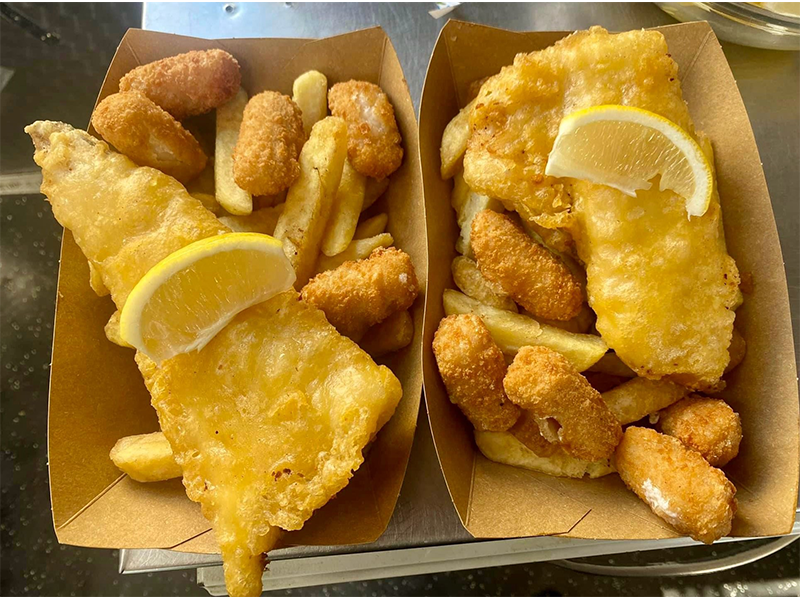
You are a GUI agent. You are given a task and a screenshot of the screen. Output one action in this format:
    pyautogui.click(x=<x>, y=<y>)
    Task: Click on the plate
    
    Given the screenshot: What is the action you would take?
    pyautogui.click(x=770, y=15)